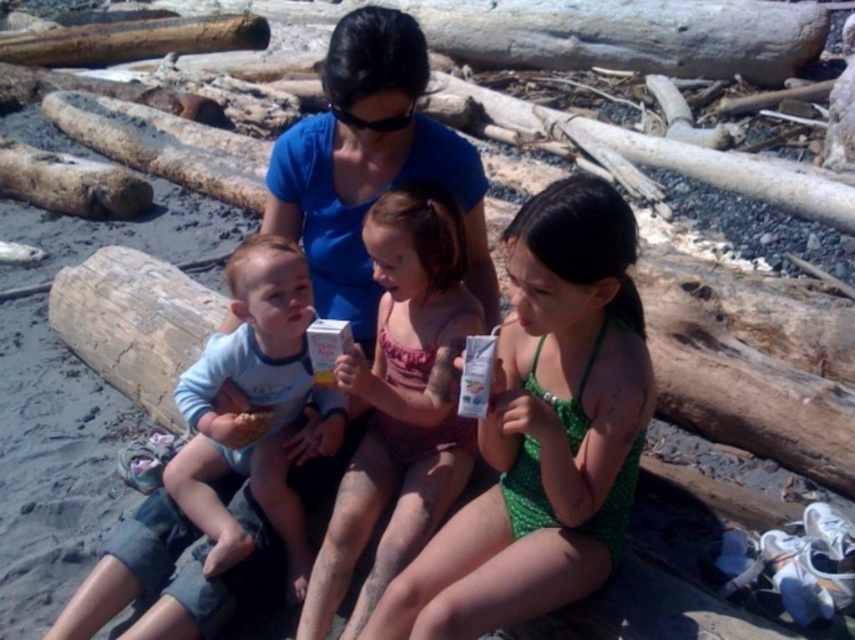
Question: Does pink fabric swimsuit at center appear under matte pink swimsuit at center?

Choices:
 (A) yes
 (B) no

Answer: (A)

Question: Considering the relative positions of pink fabric swimsuit at center and light blue cotton shirt at center in the image provided, where is pink fabric swimsuit at center located with respect to light blue cotton shirt at center?

Choices:
 (A) below
 (B) above

Answer: (B)

Question: Which of the following is the closest to the observer?

Choices:
 (A) (545, 196)
 (B) (252, 467)
 (C) (358, 392)

Answer: (A)

Question: Which of these objects is positioned closest to the pink fabric swimsuit at center?

Choices:
 (A) light blue cotton shirt at center
 (B) matte pink swimsuit at center

Answer: (B)

Question: Does matte pink swimsuit at center lie behind light blue cotton shirt at center?

Choices:
 (A) no
 (B) yes

Answer: (A)

Question: Which of the following is the closest to the observer?

Choices:
 (A) matte pink swimsuit at center
 (B) light blue cotton shirt at center
 (C) pink fabric swimsuit at center

Answer: (C)